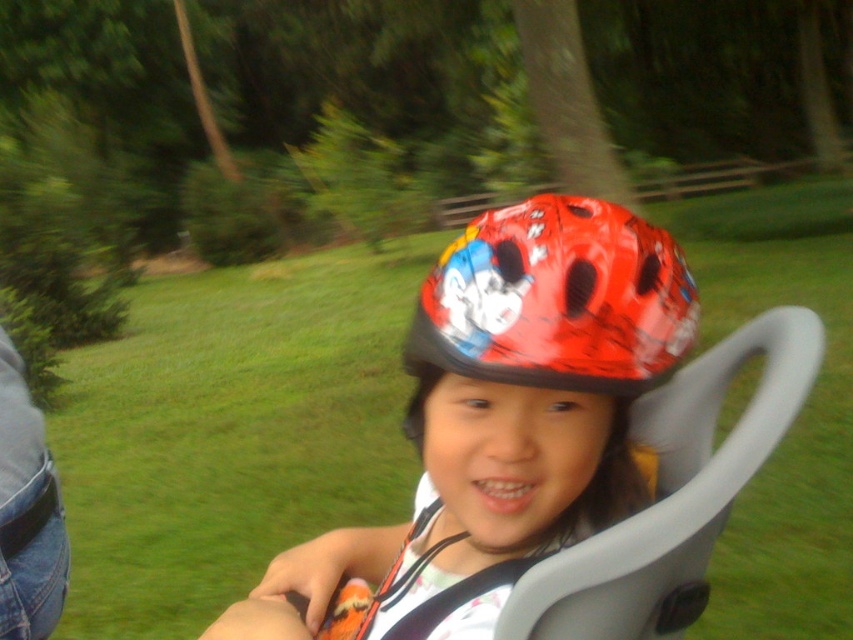
Who is more distant from viewer, (473, 525) or (569, 317)?

Point (473, 525)

Which is above, glossy plastic helmet at center or shiny red helmet at center?

shiny red helmet at center is higher up.

This screenshot has height=640, width=853. Describe the element at coordinates (503, 420) in the screenshot. I see `glossy plastic helmet at center` at that location.

You are a GUI agent. You are given a task and a screenshot of the screen. Output one action in this format:
    pyautogui.click(x=<x>, y=<y>)
    Task: Click on the glossy plastic helmet at center
    
    Given the screenshot: What is the action you would take?
    pyautogui.click(x=503, y=420)